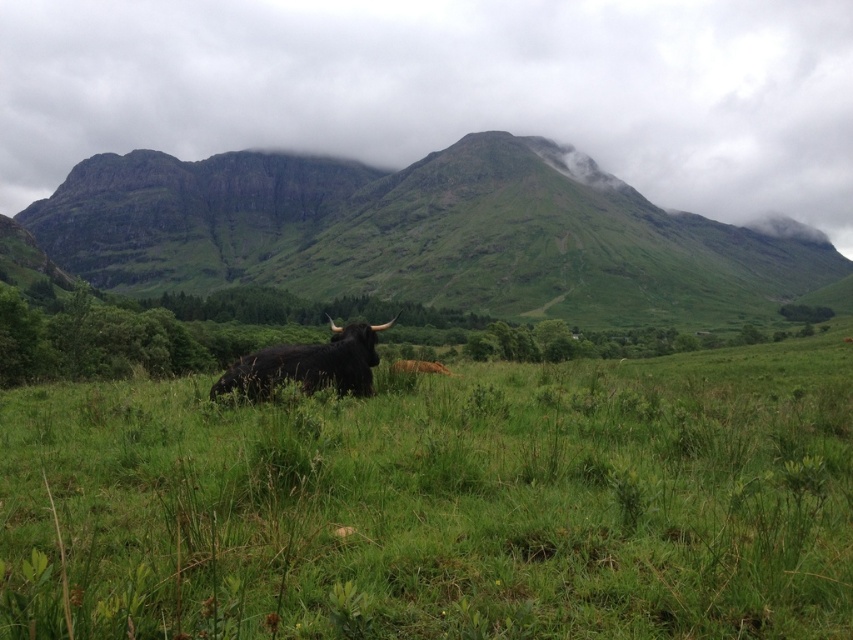
Based on the photo, you are a drone operator trying to capture a photo of the black furry bull at center and the green grassy field at center. From your current position above the scene, which object is positioned lower in the image?

The green grassy field at center is positioned below the black furry bull at center, so it is lower in the image.

You are a farmer who wants to ensure the black furry bull at center has enough space to move freely in the green grassy field at center. Based on the scene, can you confirm if the field is spacious enough for the bull?

The green grassy field at center has a larger size compared to black furry bull at center, so yes, the field is spacious enough for the bull to move freely.